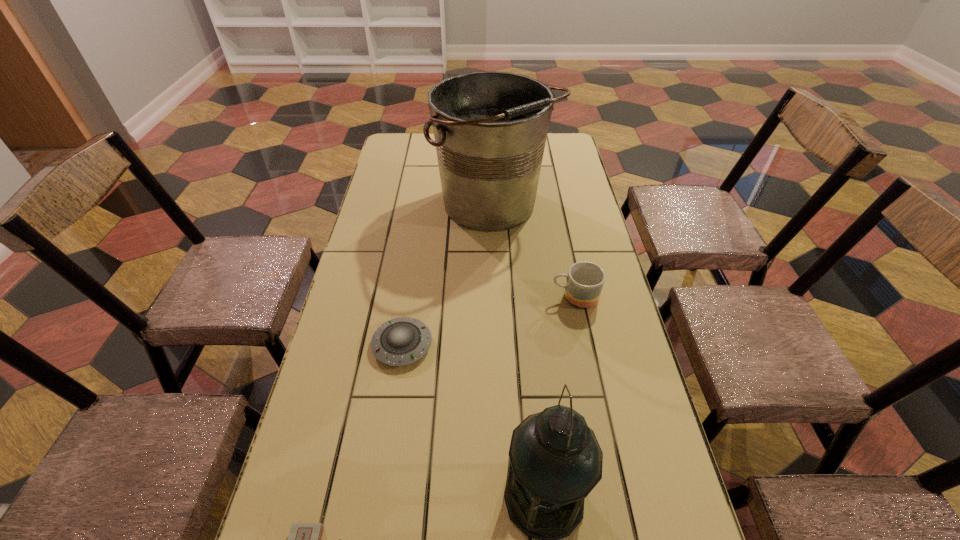
Where is `the second closest object to the fourth nearest object`? the second closest object to the fourth nearest object is located at coordinates (401, 341).